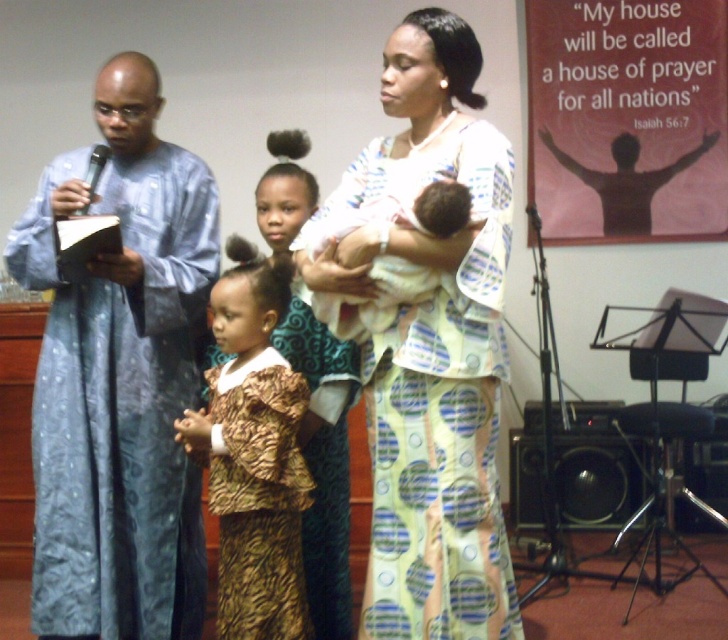
Question: Which object is positioned farthest from the matte blue robe at left?

Choices:
 (A) brown textured dress at center
 (B) soft white baby at center
 (C) light yellow printed dress at center

Answer: (A)

Question: Estimate the real-world distances between objects in this image. Which object is closer to the soft white baby at center?

Choices:
 (A) brown textured dress at center
 (B) light yellow printed dress at center
 (C) blue textured robe at left

Answer: (B)

Question: Estimate the real-world distances between objects in this image. Which object is farther from the blue textured robe at left?

Choices:
 (A) matte blue robe at left
 (B) brown textured dress at center
 (C) soft white baby at center
 (D) light yellow printed dress at center

Answer: (A)

Question: Can you confirm if blue textured robe at left is positioned to the left of brown textured dress at center?

Choices:
 (A) no
 (B) yes

Answer: (B)

Question: Is brown textured dress at center positioned in front of soft white baby at center?

Choices:
 (A) no
 (B) yes

Answer: (A)

Question: Is light yellow printed dress at center above matte blue robe at left?

Choices:
 (A) yes
 (B) no

Answer: (A)